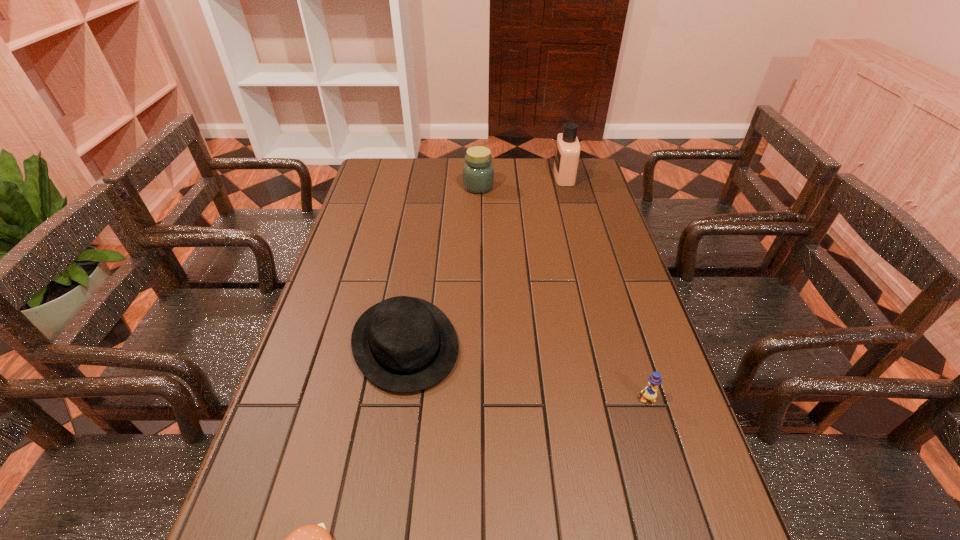
At what (x,y) coordinates should I click in order to perform the action: click on perfume. Please return your answer as a coordinate pair (x, y). The width and height of the screenshot is (960, 540). Looking at the image, I should click on (567, 152).

Find the location of a particular element. The image size is (960, 540). jar is located at coordinates (478, 173).

Where is `fedora`? fedora is located at coordinates (403, 344).

Identify the location of duckling. (650, 392).

The width and height of the screenshot is (960, 540). I want to click on vacant point located on the front label of the tallest object, so [x=533, y=177].

I want to click on vacant area located on the front label of the tallest object, so click(536, 177).

You are a GUI agent. You are given a task and a screenshot of the screen. Output one action in this format:
    pyautogui.click(x=<x>, y=<y>)
    Task: Click on the free point located on the front label of the tallest object
    The image size is (960, 540).
    Given the screenshot: What is the action you would take?
    pyautogui.click(x=513, y=177)

The image size is (960, 540). What are the coordinates of `vacant space located on the back of the fourth shortest object` in the screenshot? It's located at (478, 166).

The height and width of the screenshot is (540, 960). In order to click on blank area located on the left of the fedora in this screenshot , I will do `click(327, 343)`.

I want to click on vacant region located 0.190m on the face of the duckling, where the monocle is placed, so click(x=677, y=495).